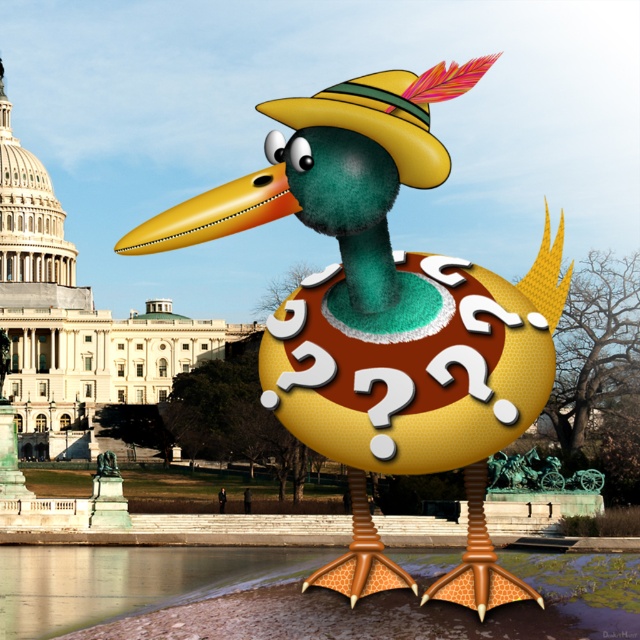
At what (x,y) coordinates should I click in order to perform the action: click on matte yellow duck at center. Please return your answer as a coordinate pair (x, y). Image resolution: width=640 pixels, height=640 pixels. Looking at the image, I should click on (387, 316).

Based on the photo, is matte yellow duck at center bigger than brushed metal statue at center?

Indeed, matte yellow duck at center has a larger size compared to brushed metal statue at center.

Who is more distant from viewer, (285,164) or (1,342)?

Point (1,342)

Identify the location of matte yellow duck at center. (387, 316).